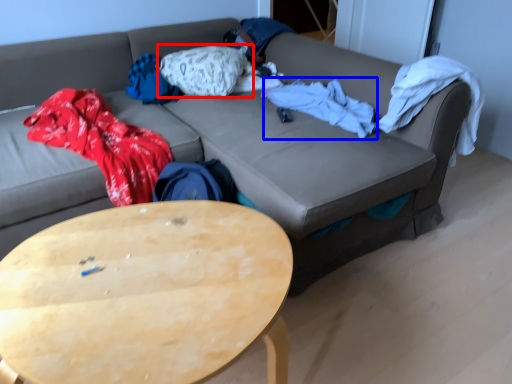
Question: Which of the following is the closest to the observer, pillow (highlighted by a red box) or blanket (highlighted by a blue box)?

Choices:
 (A) pillow
 (B) blanket

Answer: (B)